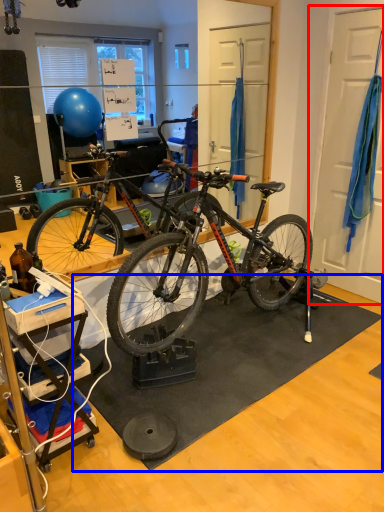
Question: Which of the following is the closest to the observer, door (highlighted by a red box) or doormat (highlighted by a blue box)?

Choices:
 (A) door
 (B) doormat

Answer: (B)